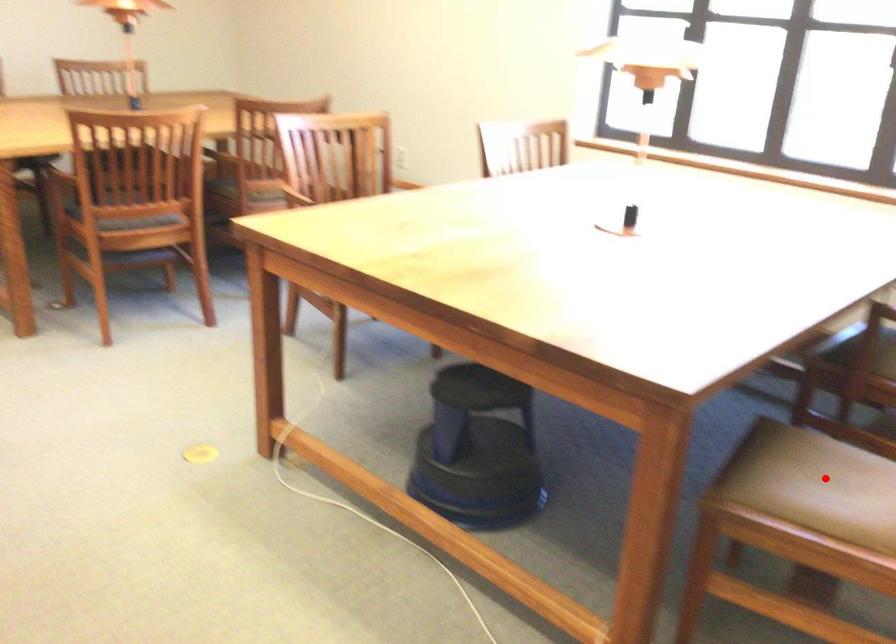
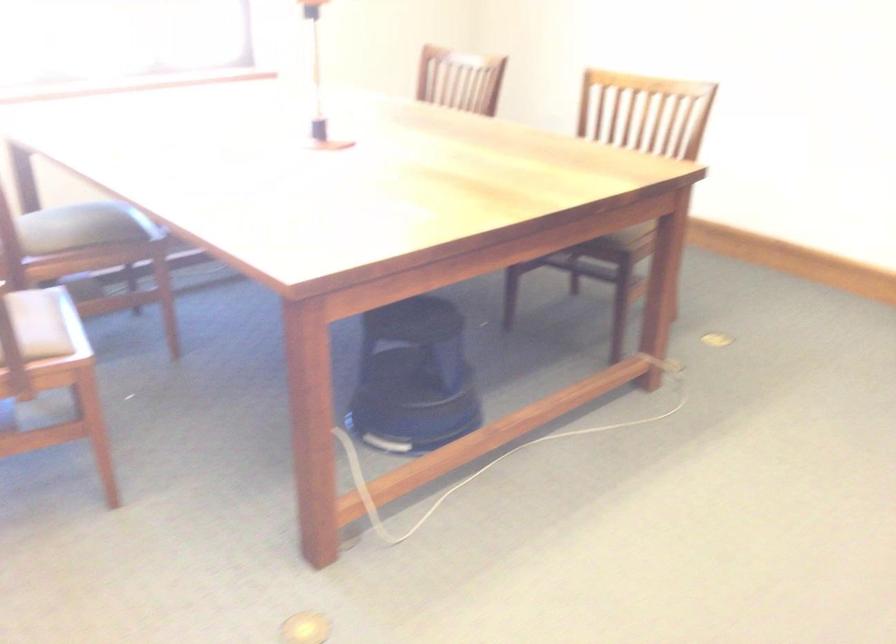
Question: I am providing you with two images of the same scene from different viewpoints. A red point is marked on the first image. Is the red point's position out of view in image 2?

Choices:
 (A) Yes
 (B) No

Answer: (A)